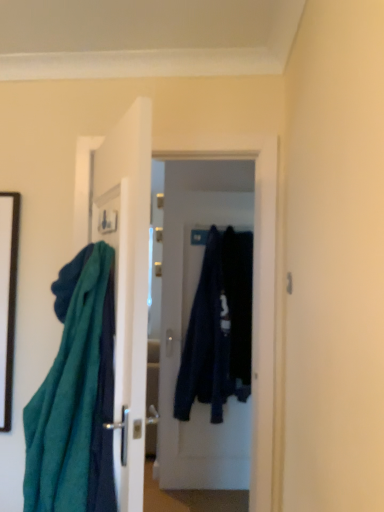
Locate an element on the screen. vacant space underneath dark blue fabric at center, which appears as the second clothing when viewed from the left (from a real-world perspective) is located at coordinates (232, 495).